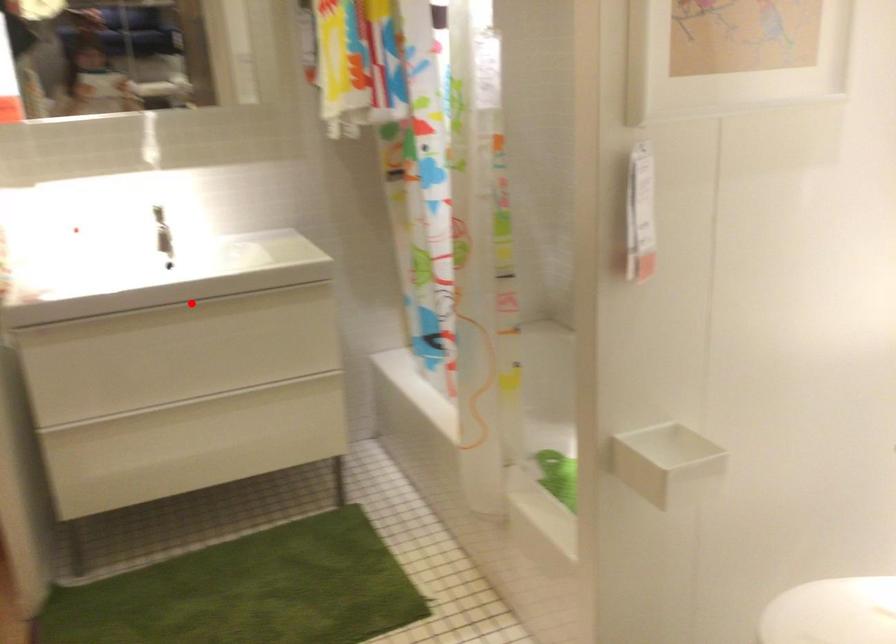
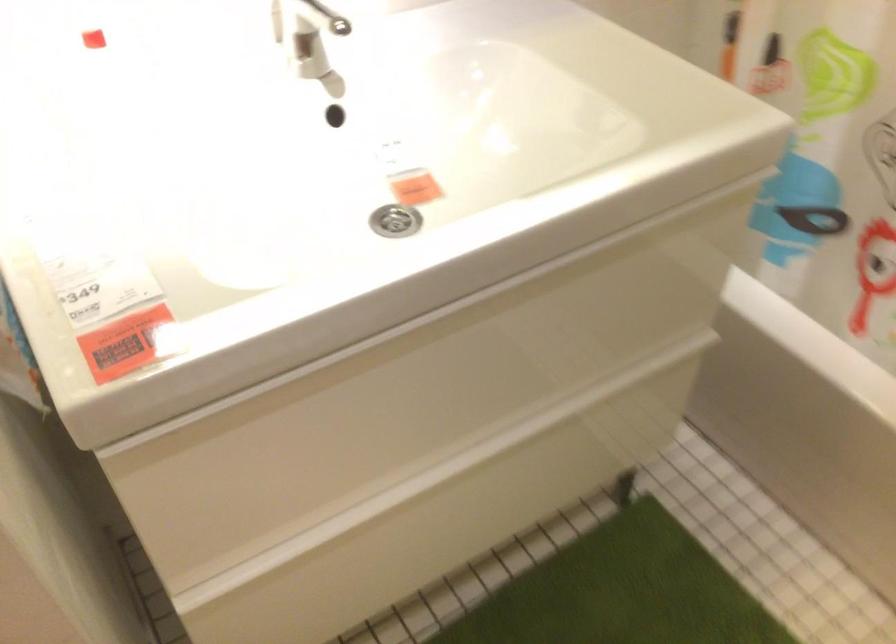
Question: I am providing you with two images of the same scene from different viewpoints. In image1, a red point is highlighted. Considering the same 3D point in image2, which of the following is correct?

Choices:
 (A) It is closer
 (B) It is farther

Answer: (A)